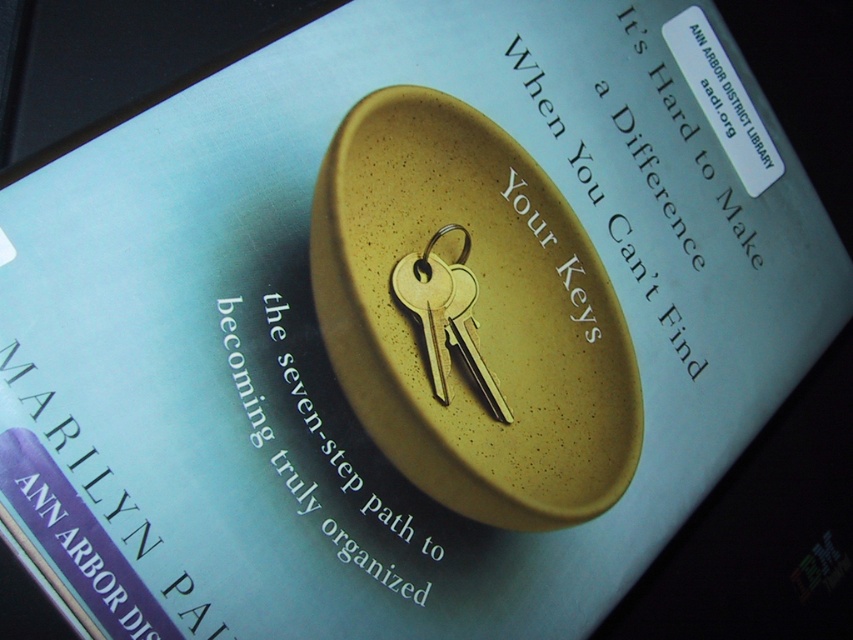
You are designing a book cover and want to ensure the goldspeckledkey ring and key at center and the gold metallic key at center are clearly visible. Which object should you adjust to avoid overlap?

The goldspeckledkey ring and key at center is positioned over gold metallic key at center, so you should adjust the position of the goldspeckledkey ring and key at center to avoid covering the gold metallic key at center.

You are designing a book cover and want to ensure that the goldspeckledkey ring and key at center and the gold metallic key at center are clearly distinguishable. Based on their sizes, which one should you place in a position where size matters for visibility?

The goldspeckledkey ring and key at center is bigger than the gold metallic key at center, so placing the larger goldspeckledkey ring and key at center in a prominent position will ensure it stands out more for visibility.